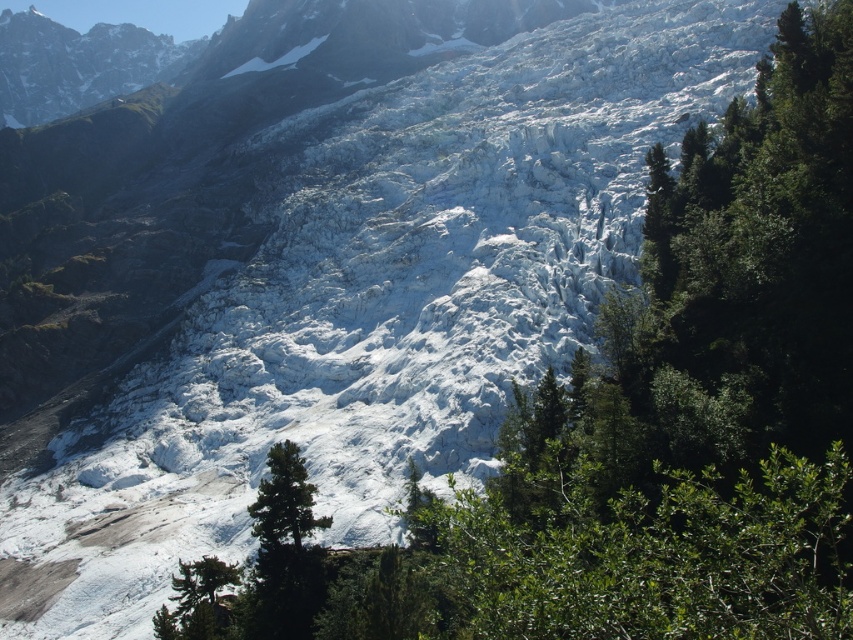
Can you confirm if green matte tree at center is positioned above green textured tree at lower left?

Yes.

Is point (294, 534) farther from viewer compared to point (181, 621)?

That is True.

This screenshot has height=640, width=853. Identify the location of green matte tree at center. pyautogui.click(x=283, y=552).